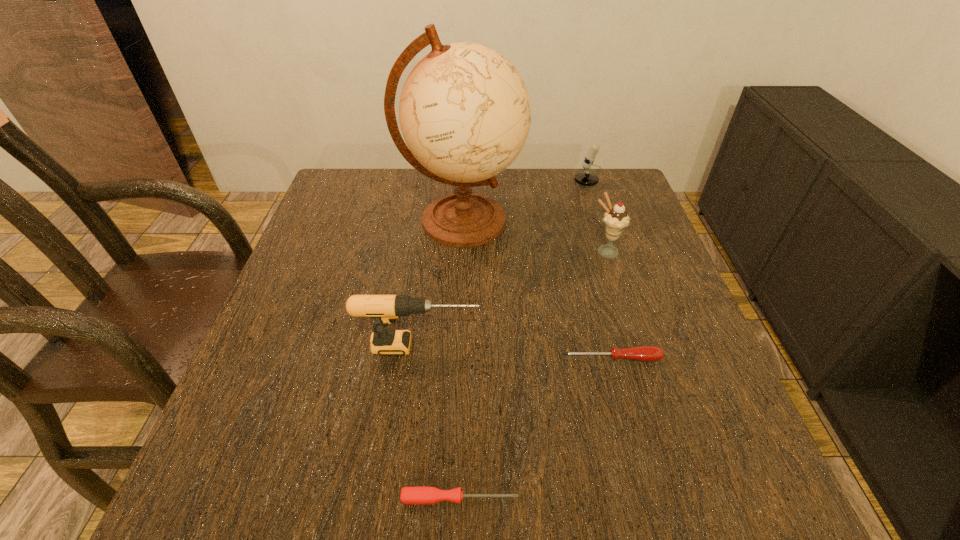
The image size is (960, 540). Identify the location of free space between the shortest object and the tallest object. (461, 360).

I want to click on vacant space in between the globe and the icecream, so click(534, 237).

The image size is (960, 540). I want to click on unoccupied area between the globe and the icecream, so click(534, 237).

Where is `free space between the globe and the right screwdriver`? The height and width of the screenshot is (540, 960). free space between the globe and the right screwdriver is located at coordinates (537, 289).

Where is `free spot between the icecream and the shorter screwdriver`? This screenshot has height=540, width=960. free spot between the icecream and the shorter screwdriver is located at coordinates (533, 375).

This screenshot has width=960, height=540. Find the location of `free area in between the second shortest object and the drill`. free area in between the second shortest object and the drill is located at coordinates (516, 352).

You are a GUI agent. You are given a task and a screenshot of the screen. Output one action in this format:
    pyautogui.click(x=<x>, y=<y>)
    Task: Click on the vacant space that is in between the icecream and the second shortest object
    
    Given the screenshot: What is the action you would take?
    pyautogui.click(x=609, y=305)

I want to click on object that is the second closest to the nearer screwdriver, so click(x=641, y=353).

Image resolution: width=960 pixels, height=540 pixels. What are the coordinates of `object identified as the third closest to the nearest object` in the screenshot? It's located at (465, 113).

Find the location of `vacant area in the image that satisfies the following two spatial constraints: 1. on the back side of the taller screwdriver; 2. on the surface of the tallest object`. vacant area in the image that satisfies the following two spatial constraints: 1. on the back side of the taller screwdriver; 2. on the surface of the tallest object is located at coordinates (576, 221).